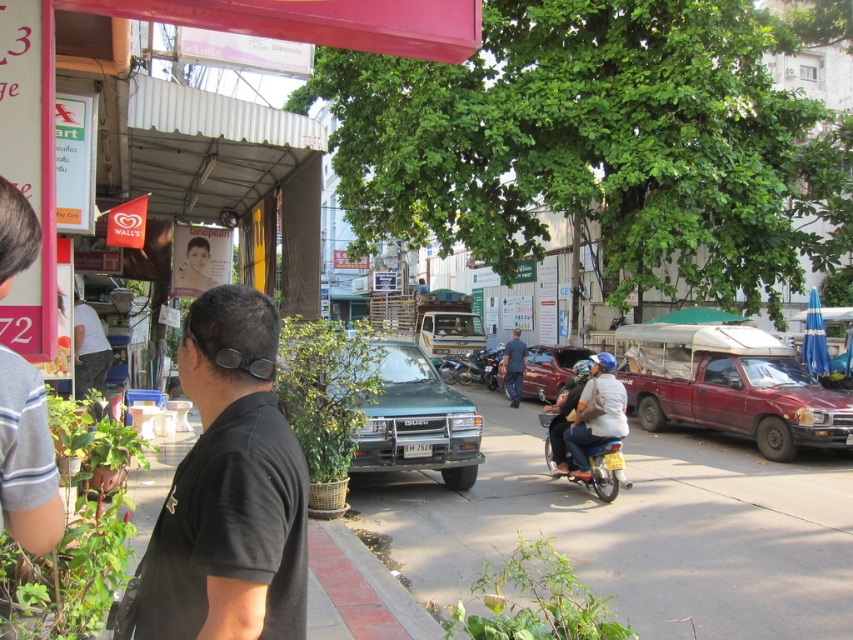
Is rusty metal pickup truck at center-right wider than shiny maroon sedan at center?

Indeed, rusty metal pickup truck at center-right has a greater width compared to shiny maroon sedan at center.

Is point (689, 364) in front of point (532, 352)?

Yes, point (689, 364) is in front of point (532, 352).

Which is behind, point (653, 380) or point (552, 346)?

Positioned behind is point (552, 346).

I want to click on rusty metal pickup truck at center-right, so click(729, 387).

Is the position of metallic silver scooter at center more distant than that of shiny maroon sedan at center?

That is False.

From the picture: Does metallic silver scooter at center lie in front of shiny maroon sedan at center?

Yes, metallic silver scooter at center is in front of shiny maroon sedan at center.

The image size is (853, 640). What do you see at coordinates (583, 449) in the screenshot? I see `metallic silver scooter at center` at bounding box center [583, 449].

You are a GUI agent. You are given a task and a screenshot of the screen. Output one action in this format:
    pyautogui.click(x=<x>, y=<y>)
    Task: Click on the metallic silver scooter at center
    
    Given the screenshot: What is the action you would take?
    [583, 449]

Is light blue fabric helmet at center bigger than metallic silver scooter at center?

Incorrect, light blue fabric helmet at center is not larger than metallic silver scooter at center.

Which is behind, point (625, 397) or point (550, 433)?

Point (550, 433)

Does point (622, 396) come in front of point (612, 458)?

No, it is not.

At what (x,y) coordinates should I click in order to perform the action: click on light blue fabric helmet at center. Please return your answer as a coordinate pair (x, y). This screenshot has height=640, width=853. Looking at the image, I should click on (596, 413).